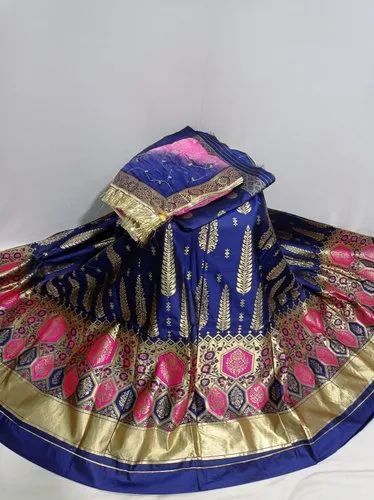
Find the location of a particular element. wall is located at coordinates (310, 176).